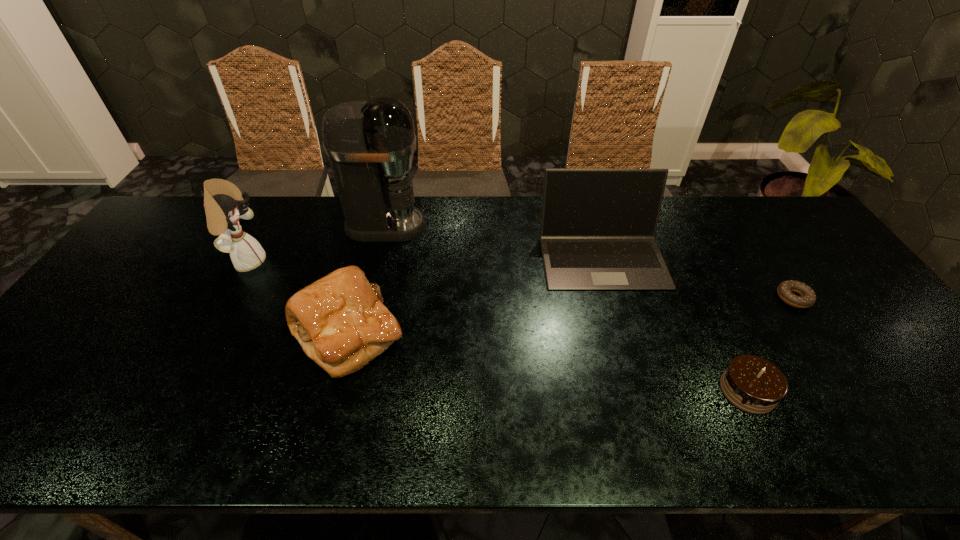
The height and width of the screenshot is (540, 960). In order to click on coffee maker in this screenshot , I will do `click(370, 144)`.

Image resolution: width=960 pixels, height=540 pixels. What are the coordinates of `the fifth shortest object` in the screenshot? It's located at (223, 202).

Identify the location of doll. (223, 202).

Image resolution: width=960 pixels, height=540 pixels. I want to click on the third tallest object, so click(598, 226).

At what (x,y) coordinates should I click in order to perform the action: click on laptop. Please return your answer as a coordinate pair (x, y). The height and width of the screenshot is (540, 960). Looking at the image, I should click on (598, 226).

The image size is (960, 540). I want to click on the third shortest object, so pyautogui.click(x=340, y=321).

At what (x,y) coordinates should I click in order to perform the action: click on chocolate cake. Please return your answer as a coordinate pair (x, y). Looking at the image, I should click on (753, 384).

You are a GUI agent. You are given a task and a screenshot of the screen. Output one action in this format:
    pyautogui.click(x=<x>, y=<y>)
    Task: Click on the fifth tallest object
    The width and height of the screenshot is (960, 540).
    Given the screenshot: What is the action you would take?
    pyautogui.click(x=753, y=384)

This screenshot has height=540, width=960. Find the location of `the rightmost object`. the rightmost object is located at coordinates (807, 298).

You are a GUI agent. You are given a task and a screenshot of the screen. Output one action in this format:
    pyautogui.click(x=<x>, y=<y>)
    Task: Click on the shortest object
    The width and height of the screenshot is (960, 540).
    Given the screenshot: What is the action you would take?
    pyautogui.click(x=807, y=298)